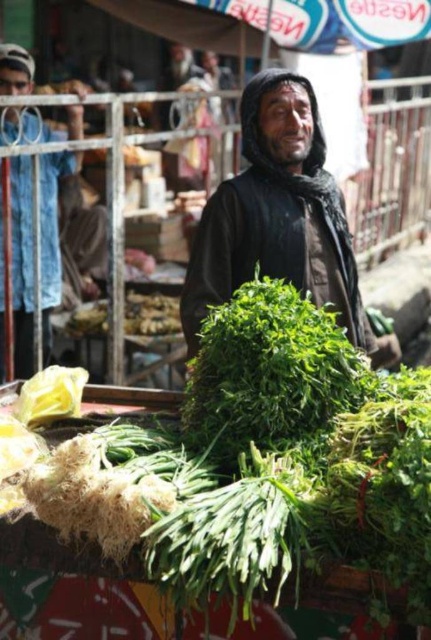
Question: Among these objects, which one is farthest from the camera?

Choices:
 (A) blue fabric at left
 (B) dark brown fabric at center

Answer: (A)

Question: Which point is farther to the camera?

Choices:
 (A) (269, 275)
 (B) (19, 54)

Answer: (B)

Question: Is dark brown fabric at center wider than blue fabric at left?

Choices:
 (A) yes
 (B) no

Answer: (A)

Question: Does dark brown fabric at center have a smaller size compared to blue fabric at left?

Choices:
 (A) no
 (B) yes

Answer: (A)

Question: Does dark brown fabric at center have a lesser width compared to blue fabric at left?

Choices:
 (A) no
 (B) yes

Answer: (A)